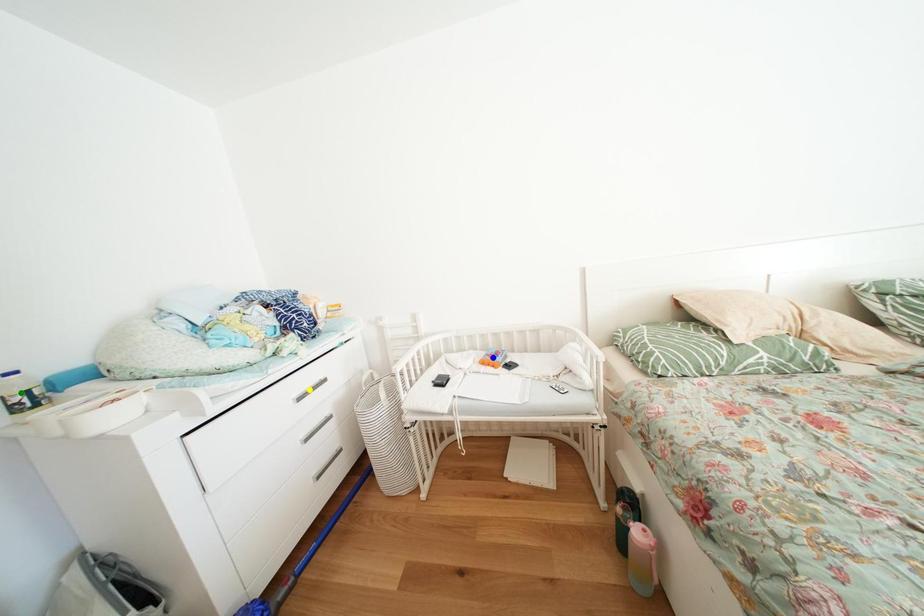
Order these from nearest to farthest:
1. green point
2. blue point
3. yellow point

green point < yellow point < blue point